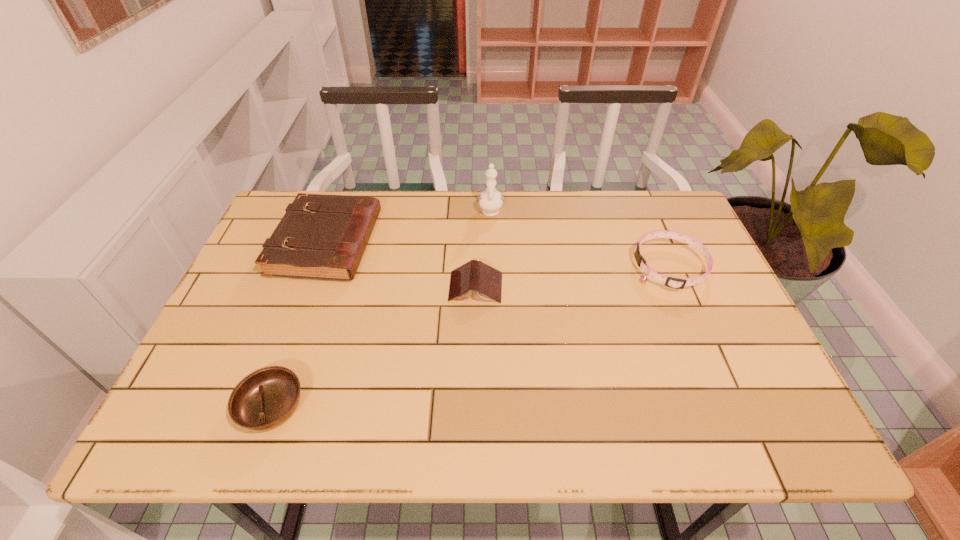
At what (x,y) coordinates should I click in order to perform the action: click on vacant space in between the rightmost object and the book. Please return your answer as a coordinate pair (x, y). Looking at the image, I should click on (573, 277).

Find the location of a particular element. vacant area that lies between the book and the dog collar is located at coordinates (573, 277).

The width and height of the screenshot is (960, 540). Identify the location of free space between the soup bowl and the chinaware. (381, 308).

Identify the location of empty space between the book and the nearest object. (374, 347).

Image resolution: width=960 pixels, height=540 pixels. Identify the location of free space between the fourth shortest object and the book. (401, 265).

Identify which object is the third closest to the chinaware. Please provide its 2D coordinates. Your answer should be formatted as a tuple, i.e. [(x, y)], where the tuple contains the x and y coordinates of a point satisfying the conditions above.

[(677, 283)]

Identify which object is the third closest to the hardback book. Please provide its 2D coordinates. Your answer should be formatted as a tuple, i.e. [(x, y)], where the tuple contains the x and y coordinates of a point satisfying the conditions above.

[(490, 201)]

Where is `vacant position in the image that satisfies the following two spatial constraints: 1. on the front side of the nearest object; 2. on the left side of the fourth shortest object`? Image resolution: width=960 pixels, height=540 pixels. vacant position in the image that satisfies the following two spatial constraints: 1. on the front side of the nearest object; 2. on the left side of the fourth shortest object is located at coordinates (268, 407).